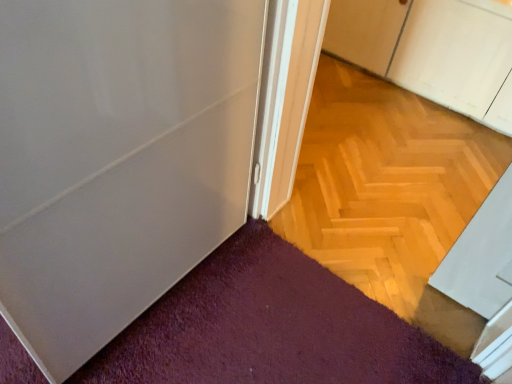
Locate an element on the screen. The image size is (512, 384). purple carpet at lower left is located at coordinates (271, 327).

Measure the distance between point (285, 283) and camera.

The depth of point (285, 283) is 1.39 meters.

The width and height of the screenshot is (512, 384). What do you see at coordinates (271, 327) in the screenshot?
I see `purple carpet at lower left` at bounding box center [271, 327].

This screenshot has height=384, width=512. I want to click on purple carpet at lower left, so click(271, 327).